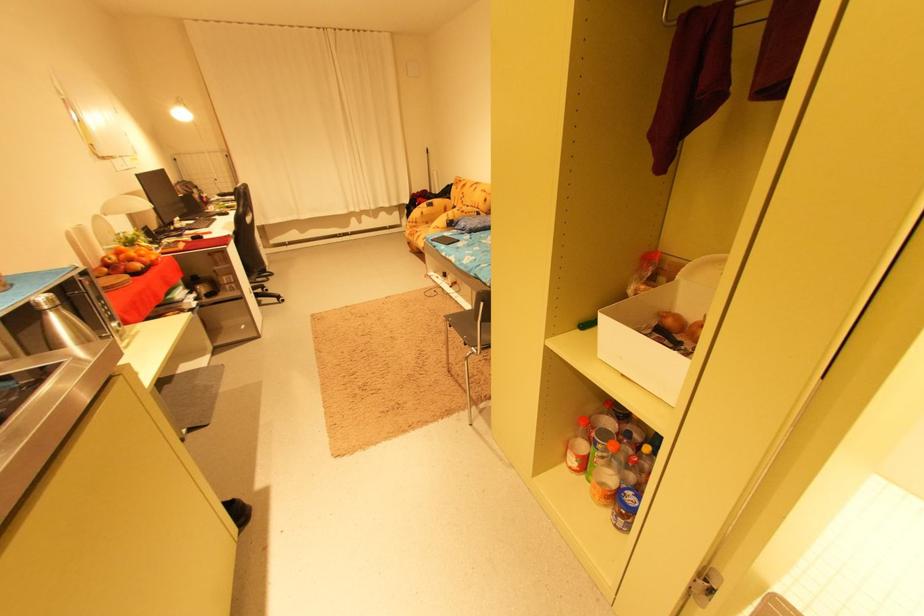
Where would you lift the yellow patterned pillow? Please return your answer as a coordinate pair (x, y).

(463, 187)